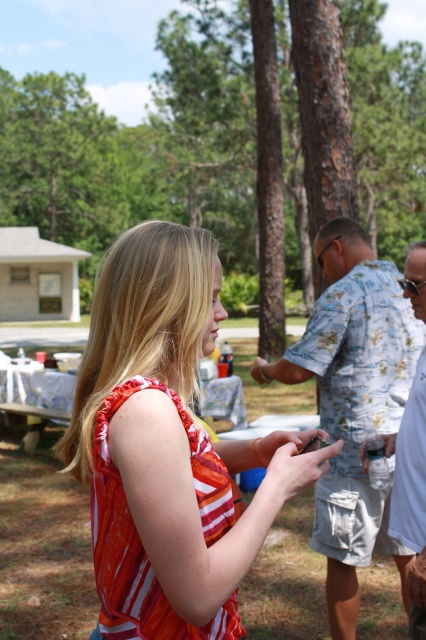
You are planning to take a photo of the two men in the scene. Since the man in the floral shirt at center is much taller than the man in the white cotton shirt at right, how should you position them to ensure both are fully visible in the frame?

Position the man in the floral shirt at center slightly behind the man in the white cotton shirt at right so that his greater height doesn t block the shorter man. This way, both will be fully visible in the photo.

You are standing in the picnic area and see two people wearing orange striped tank top at center and white cotton shirt at right. Which one is positioned more to the left?

The orange striped tank top at center is positioned more to the left than the white cotton shirt at right.

You are a photographer at the event and want to take a photo that includes both the orange striped tank top at center and the floral shirt at center. Which clothing item should you focus on first to ensure both are in frame?

The orange striped tank top at center is smaller than the floral shirt at center, so you should focus on the orange striped tank top at center first to ensure both are in frame.